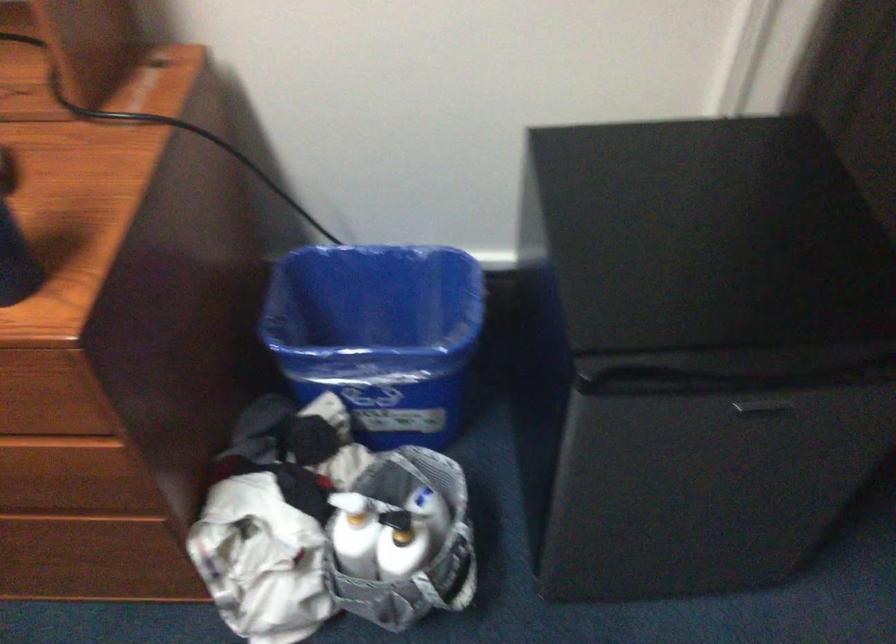
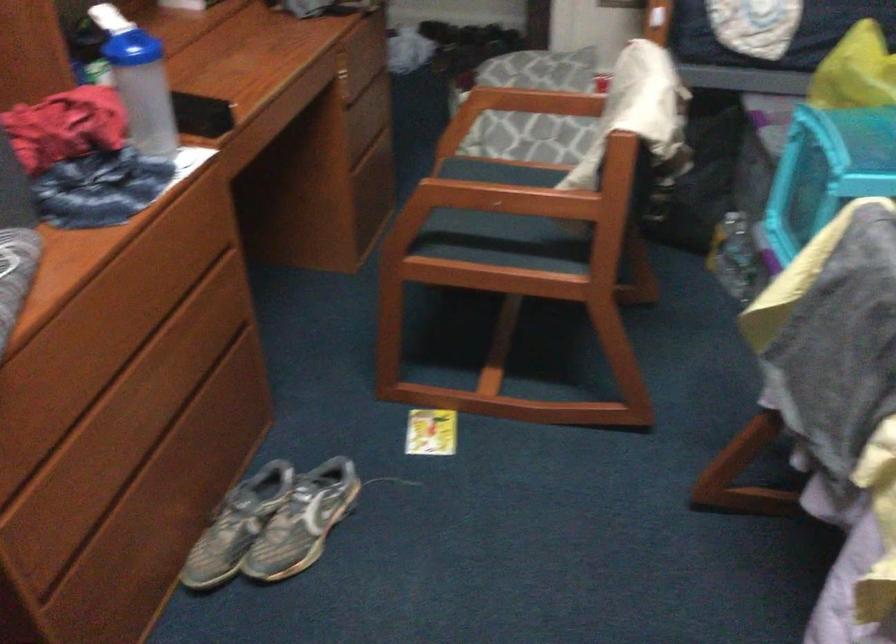
In the scene shown: The images are taken continuously from a first-person perspective. In which direction is your viewpoint rotating?

The camera rotated toward left-down.